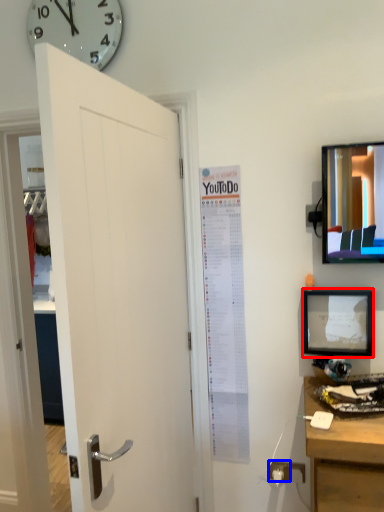
Question: Among these objects, which one is nearest to the camera, picture frame (highlighted by a red box) or electric outlet (highlighted by a blue box)?

Choices:
 (A) picture frame
 (B) electric outlet

Answer: (A)